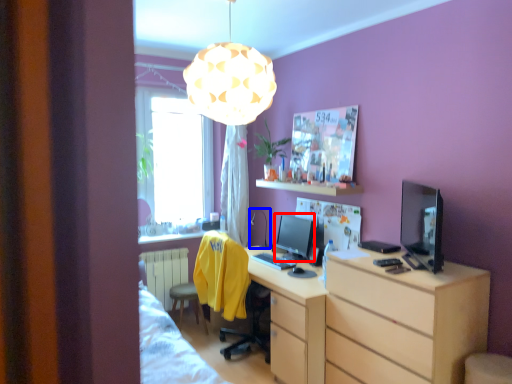
Question: Which object is closer to the camera taking this photo, computer monitor (highlighted by a red box) or table lamp (highlighted by a blue box)?

Choices:
 (A) computer monitor
 (B) table lamp

Answer: (A)